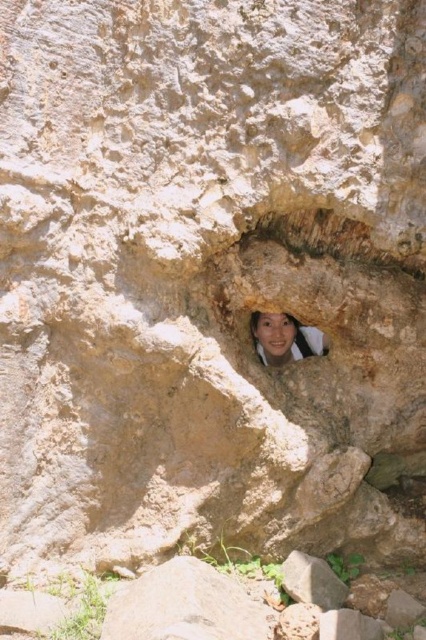
Question: Does smooth beige face at center appear over gray rough rock at center?

Choices:
 (A) yes
 (B) no

Answer: (A)

Question: Which point is closer to the camera?

Choices:
 (A) smooth beige face at center
 (B) gray rough rock at center

Answer: (B)

Question: Which point is farther to the camera?

Choices:
 (A) (296, 358)
 (B) (305, 602)

Answer: (A)

Question: Can you confirm if smooth beige face at center is bigger than gray rough rock at center?

Choices:
 (A) yes
 (B) no

Answer: (A)

Question: Does smooth beige face at center appear over gray rough rock at center?

Choices:
 (A) yes
 (B) no

Answer: (A)